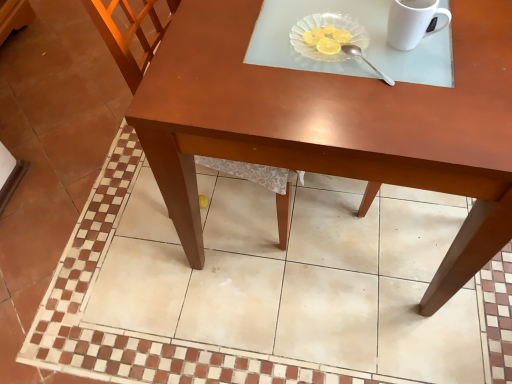
Where is `free space to the left of wooden chair at center`? free space to the left of wooden chair at center is located at coordinates (95, 203).